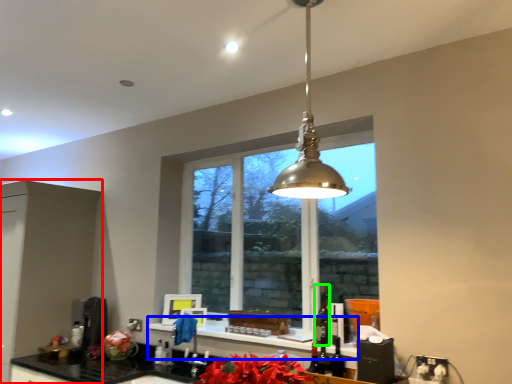
Question: Which object is positioned closest to cabinetry (highlighted by a red box)? Select from window sill (highlighted by a blue box) and alcohol (highlighted by a green box).

Choices:
 (A) window sill
 (B) alcohol

Answer: (A)